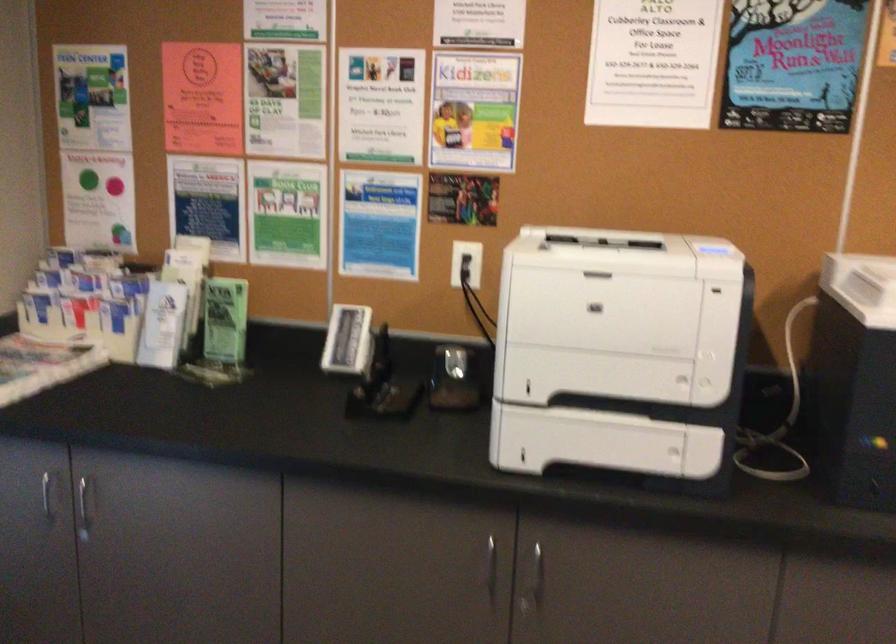
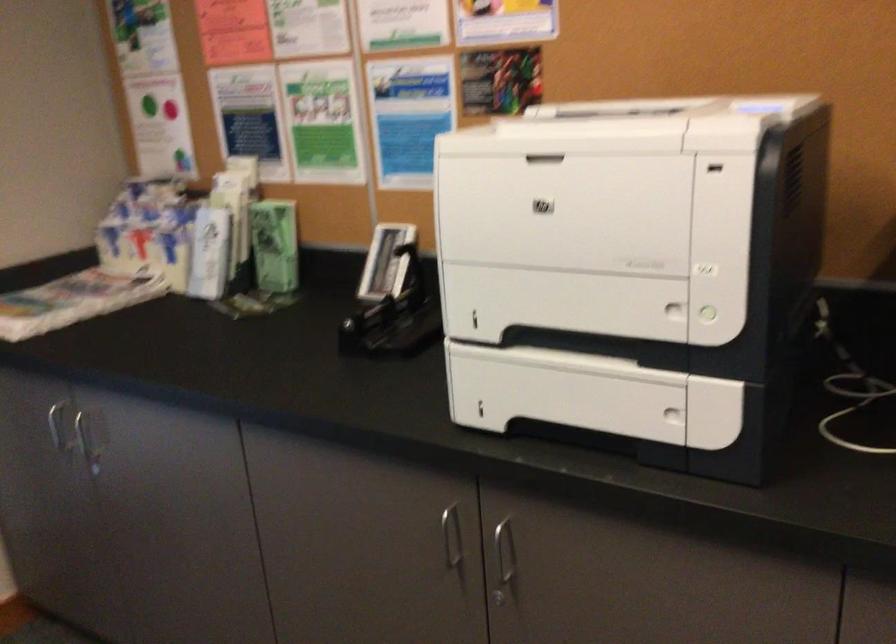
In the second image, find the point that corresponds to the point at 487,558 in the first image.

(452, 538)